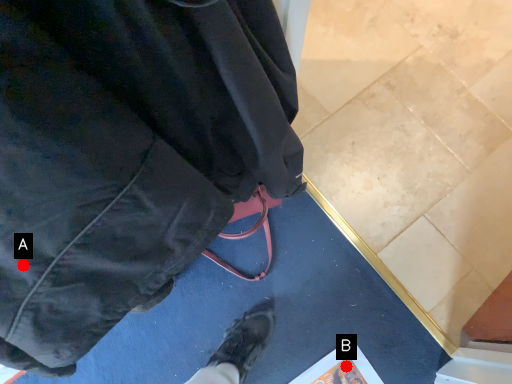
Question: Two points are circled on the image, labeled by A and B beside each circle. Among these points, which one is nearest to the camera?

Choices:
 (A) A is closer
 (B) B is closer

Answer: (A)